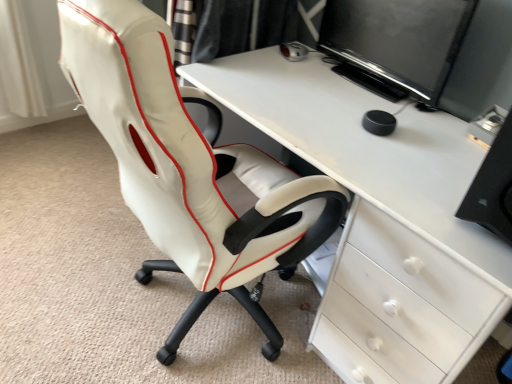
Question: Considering the relative sizes of black plastic computer tower at right and black glossy monitor at upper right in the image provided, is black plastic computer tower at right shorter than black glossy monitor at upper right?

Choices:
 (A) yes
 (B) no

Answer: (A)

Question: Considering the relative sizes of black plastic computer tower at right and black glossy monitor at upper right in the image provided, is black plastic computer tower at right bigger than black glossy monitor at upper right?

Choices:
 (A) no
 (B) yes

Answer: (B)

Question: Considering the relative positions of black plastic computer tower at right and black glossy monitor at upper right in the image provided, is black plastic computer tower at right to the right of black glossy monitor at upper right from the viewer's perspective?

Choices:
 (A) yes
 (B) no

Answer: (A)

Question: Would you say black glossy monitor at upper right is part of black plastic computer tower at right's contents?

Choices:
 (A) no
 (B) yes

Answer: (A)

Question: Is black plastic computer tower at right in front of black glossy monitor at upper right?

Choices:
 (A) yes
 (B) no

Answer: (A)

Question: From a real-world perspective, is black plastic computer tower at right above or below black glossy monitor at upper right?

Choices:
 (A) below
 (B) above

Answer: (A)

Question: Visually, is black plastic computer tower at right positioned to the left or to the right of black glossy monitor at upper right?

Choices:
 (A) right
 (B) left

Answer: (A)

Question: Looking at their shapes, would you say black plastic computer tower at right is wider or thinner than black glossy monitor at upper right?

Choices:
 (A) wide
 (B) thin

Answer: (A)

Question: From the image's perspective, relative to black glossy monitor at upper right, is black plastic computer tower at right above or below?

Choices:
 (A) above
 (B) below

Answer: (B)

Question: Considering the positions of black glossy monitor at upper right and white leather chair at center in the image, is black glossy monitor at upper right taller or shorter than white leather chair at center?

Choices:
 (A) tall
 (B) short

Answer: (B)

Question: In terms of size, does black glossy monitor at upper right appear bigger or smaller than white leather chair at center?

Choices:
 (A) small
 (B) big

Answer: (A)

Question: Looking at their shapes, would you say black glossy monitor at upper right is wider or thinner than white leather chair at center?

Choices:
 (A) thin
 (B) wide

Answer: (A)

Question: From the image's perspective, relative to white leather chair at center, is black glossy monitor at upper right above or below?

Choices:
 (A) below
 (B) above

Answer: (B)

Question: Is white glossy desk at center spatially inside black glossy monitor at upper right, or outside of it?

Choices:
 (A) outside
 (B) inside

Answer: (A)

Question: Considering the positions of white glossy desk at center and black glossy monitor at upper right in the image, is white glossy desk at center taller or shorter than black glossy monitor at upper right?

Choices:
 (A) tall
 (B) short

Answer: (A)